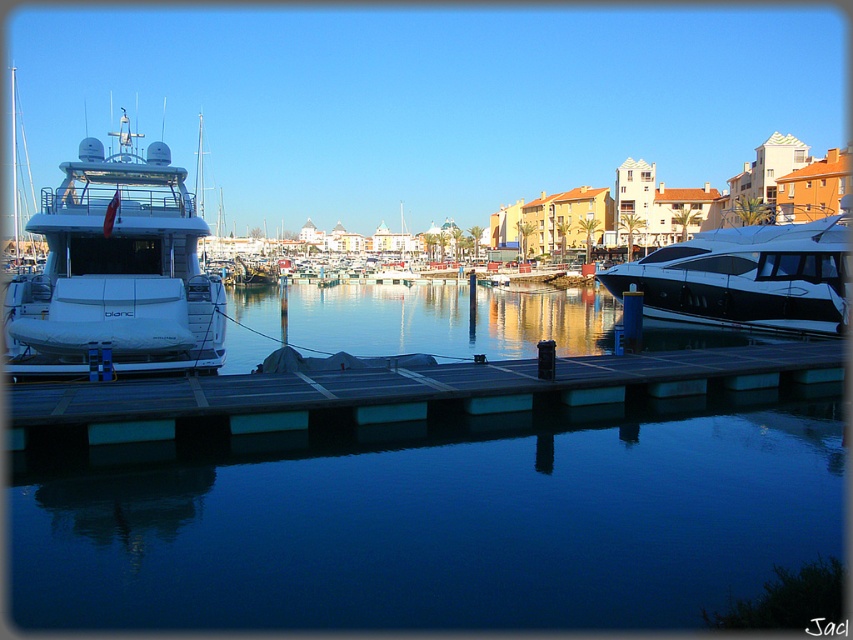
Question: Can you confirm if dark gray wooden dock at center is bigger than white glossy yacht at right?

Choices:
 (A) yes
 (B) no

Answer: (B)

Question: Which of the following is the closest to the observer?

Choices:
 (A) transparent glass water at center
 (B) dark gray wooden dock at center

Answer: (A)

Question: Does dark gray wooden dock at center appear under white glossy yacht at right?

Choices:
 (A) no
 (B) yes

Answer: (B)

Question: Which of these objects is positioned closest to the white glossy yacht at right?

Choices:
 (A) dark gray wooden dock at center
 (B) white glossy yacht at left
 (C) transparent glass water at center

Answer: (A)

Question: Is dark gray wooden dock at center positioned in front of white glossy yacht at right?

Choices:
 (A) no
 (B) yes

Answer: (B)

Question: Which point is closer to the camera taking this photo?

Choices:
 (A) (163, 224)
 (B) (523, 330)
 (C) (62, 392)
 (D) (822, 552)

Answer: (D)